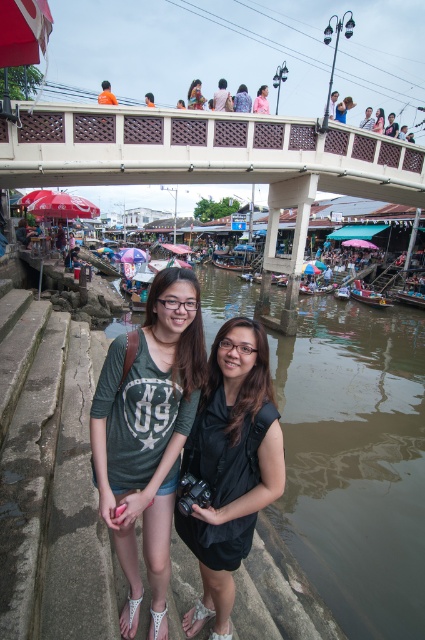
You are a photographer trying to capture a shot of the brown murky water at lower center and the black matte vest at center. Based on their positions, which object is closer to the camera?

The brown murky water at lower center is located above the black matte vest at center, so it is closer to the camera.

You are a photographer standing on the white concrete bridge at upper center and want to take a photo of the wooden polished boat at lower center. Is the boat visible from your current position?

The white concrete bridge at upper center is positioned over the wooden polished boat at lower center, so the boat is directly underneath the bridge. Since the bridge is above the boat, you should be able to see the boat from your position on the bridge unless there are any obstructions like pillars or structures blocking the view.